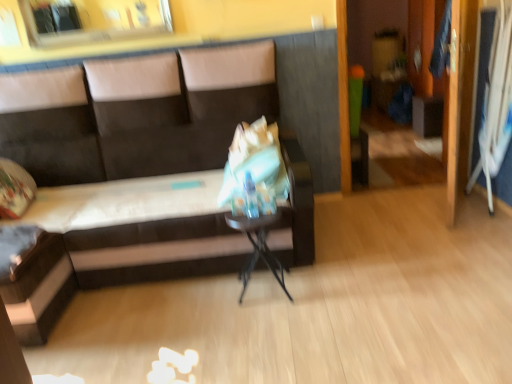
Where is `blank space to the left of metallic silver table at center`? blank space to the left of metallic silver table at center is located at coordinates (219, 301).